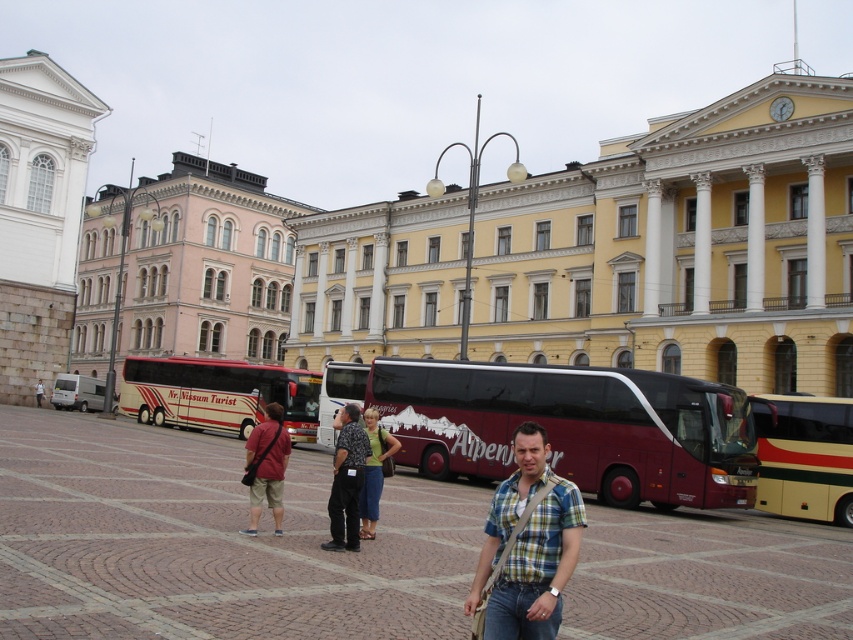
Question: Which object is farther from the camera taking this photo?

Choices:
 (A) white stone building at upper left
 (B) dark blue jeans at center
 (C) green fabric shirt at center
 (D) matte red shirt at center

Answer: (A)

Question: Is plaid cotton shirt at center wider than dark blue jeans at center?

Choices:
 (A) yes
 (B) no

Answer: (B)

Question: Does beige fabric coach at center have a lesser width compared to dark blue jeans at center?

Choices:
 (A) yes
 (B) no

Answer: (B)

Question: Which object is closer to the camera taking this photo?

Choices:
 (A) maroon leather bus at center
 (B) plaid cotton shirt at center
 (C) green fabric shirt at center
 (D) maroon metallic bus at center

Answer: (B)

Question: Is maroon metallic bus at center above green fabric shirt at center?

Choices:
 (A) yes
 (B) no

Answer: (B)

Question: Among these objects, which one is farthest from the camera?

Choices:
 (A) beige fabric coach at center
 (B) dark blue jeans at center
 (C) plaid cotton shirt at center

Answer: (A)